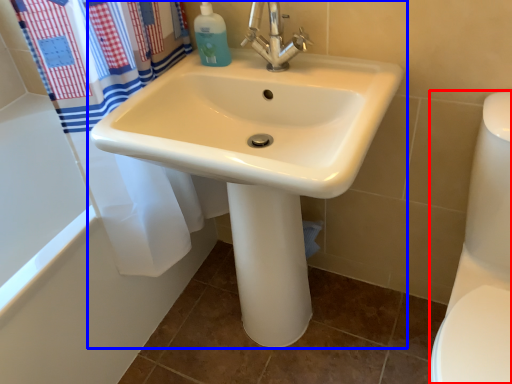
Question: Which of the following is the farthest to the observer, toilet bowl (highlighted by a red box) or sink (highlighted by a blue box)?

Choices:
 (A) toilet bowl
 (B) sink

Answer: (B)